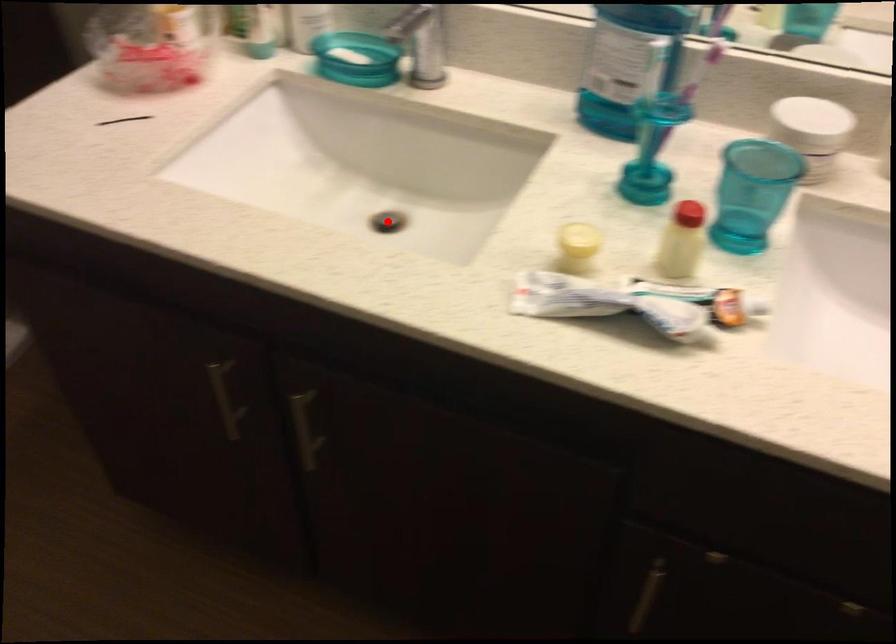
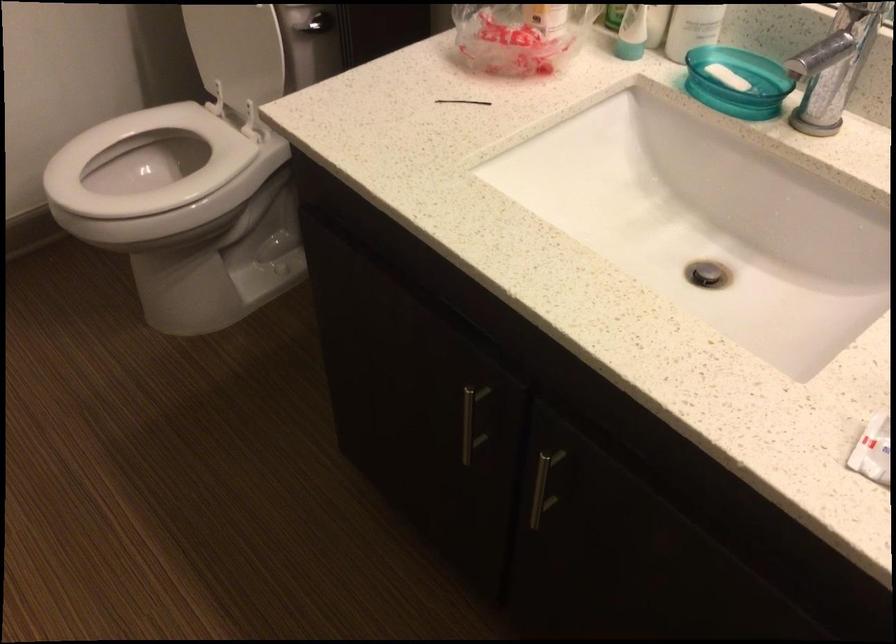
Question: A red point is marked in image1. In image2, is the corresponding 3D point closer to the camera or farther? Reply with the corresponding letter.

Choices:
 (A) The corresponding 3D point is closer.
 (B) The corresponding 3D point is farther.

Answer: (A)